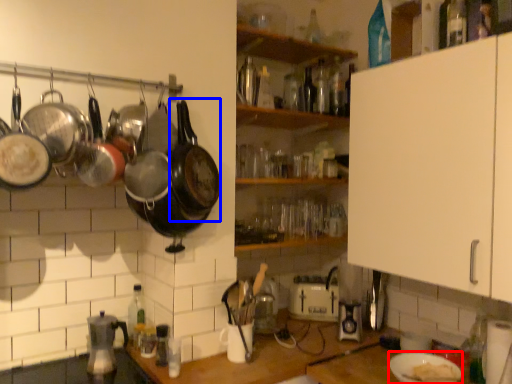
Question: Which of the following is the closest to the observer, appliance (highlighted by a red box) or wok (highlighted by a blue box)?

Choices:
 (A) appliance
 (B) wok

Answer: (A)